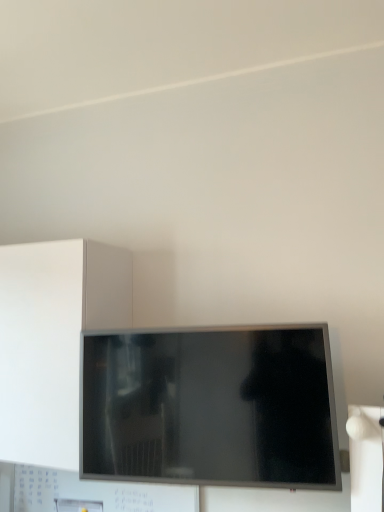
Question: Can you confirm if matte black tv at center is positioned to the right of white matte cabinet at left?

Choices:
 (A) yes
 (B) no

Answer: (A)

Question: Is matte black tv at center facing towards white matte cabinet at left?

Choices:
 (A) no
 (B) yes

Answer: (A)

Question: Can you confirm if matte black tv at center is thinner than white matte cabinet at left?

Choices:
 (A) yes
 (B) no

Answer: (A)

Question: From the image's perspective, does matte black tv at center appear lower than white matte cabinet at left?

Choices:
 (A) no
 (B) yes

Answer: (B)

Question: Can you confirm if matte black tv at center is wider than white matte cabinet at left?

Choices:
 (A) no
 (B) yes

Answer: (A)

Question: Considering the relative sizes of matte black tv at center and white matte cabinet at left in the image provided, is matte black tv at center smaller than white matte cabinet at left?

Choices:
 (A) no
 (B) yes

Answer: (B)

Question: Would you say white matte cabinet at left is a long distance from matte black tv at center?

Choices:
 (A) no
 (B) yes

Answer: (A)

Question: Can you confirm if white matte cabinet at left is thinner than matte black tv at center?

Choices:
 (A) no
 (B) yes

Answer: (A)

Question: Is white matte cabinet at left shorter than matte black tv at center?

Choices:
 (A) no
 (B) yes

Answer: (A)

Question: Is white matte cabinet at left taller than matte black tv at center?

Choices:
 (A) yes
 (B) no

Answer: (A)

Question: Can you see white matte cabinet at left touching matte black tv at center?

Choices:
 (A) yes
 (B) no

Answer: (B)

Question: Does white matte cabinet at left turn towards matte black tv at center?

Choices:
 (A) no
 (B) yes

Answer: (A)

Question: Relative to white matte cabinet at left, is matte black tv at center in front or behind?

Choices:
 (A) front
 (B) behind

Answer: (A)